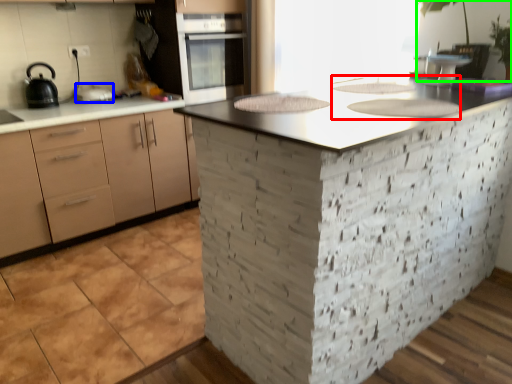
Question: Based on their relative distances, which object is farther from sink (highlighted by a red box)? Choose from kitchen appliance (highlighted by a blue box) and plant (highlighted by a green box).

Choices:
 (A) kitchen appliance
 (B) plant

Answer: (A)